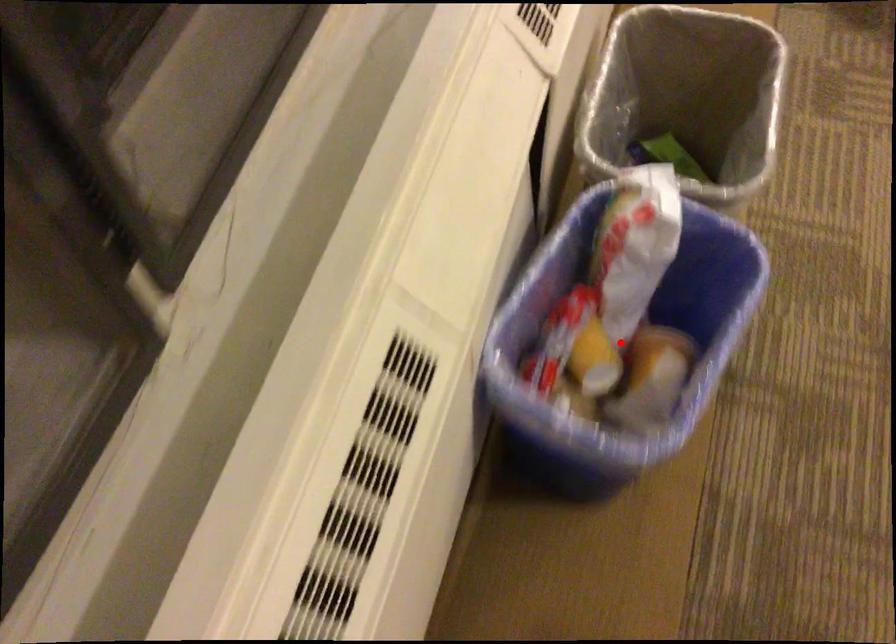
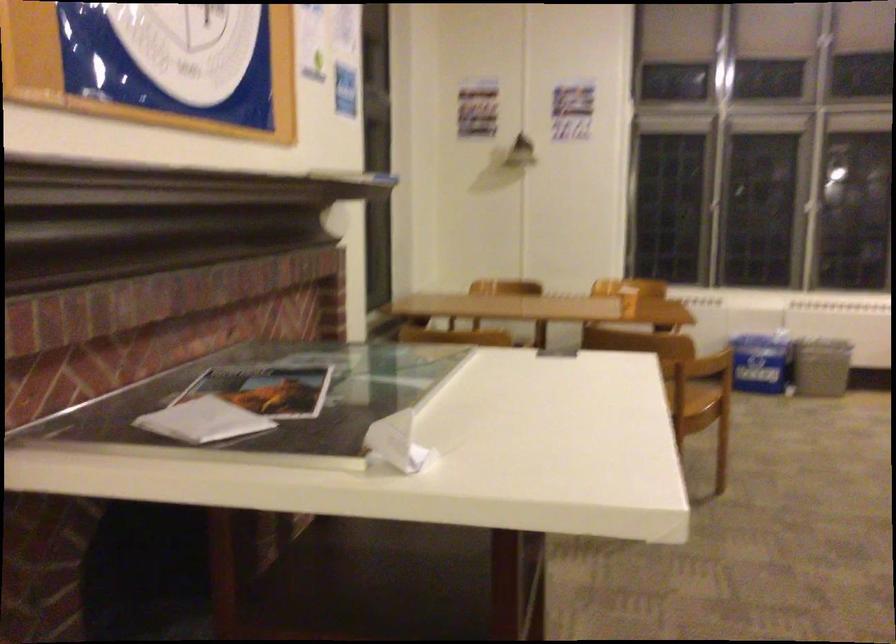
Question: I am providing you with two images of the same scene from different viewpoints. A red point is marked on the first image. Can you still see the location of the red point in image 2?

Choices:
 (A) Yes
 (B) No

Answer: (B)